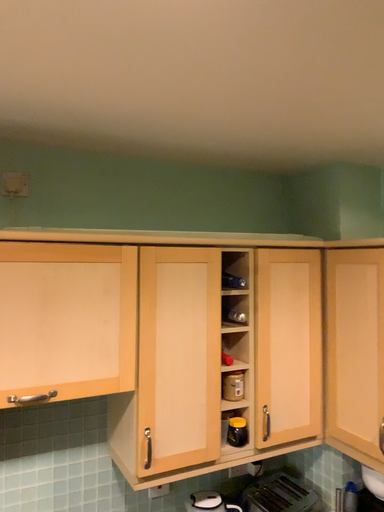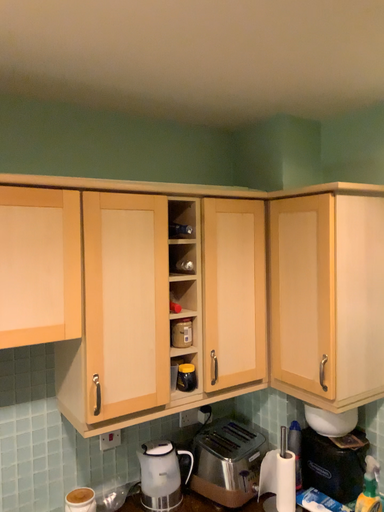
Question: Which way did the camera rotate in the video?

Choices:
 (A) rotated right
 (B) rotated left

Answer: (A)